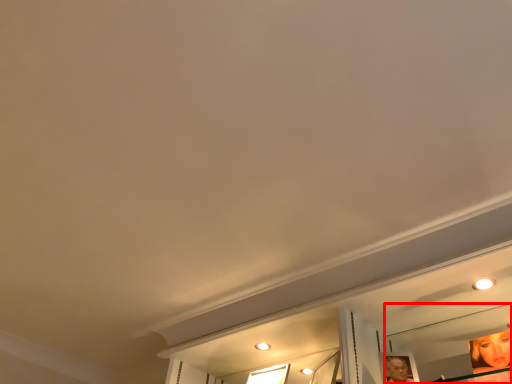
Question: In this image, where is mirror (annotated by the red box) located relative to window?

Choices:
 (A) right
 (B) left

Answer: (A)